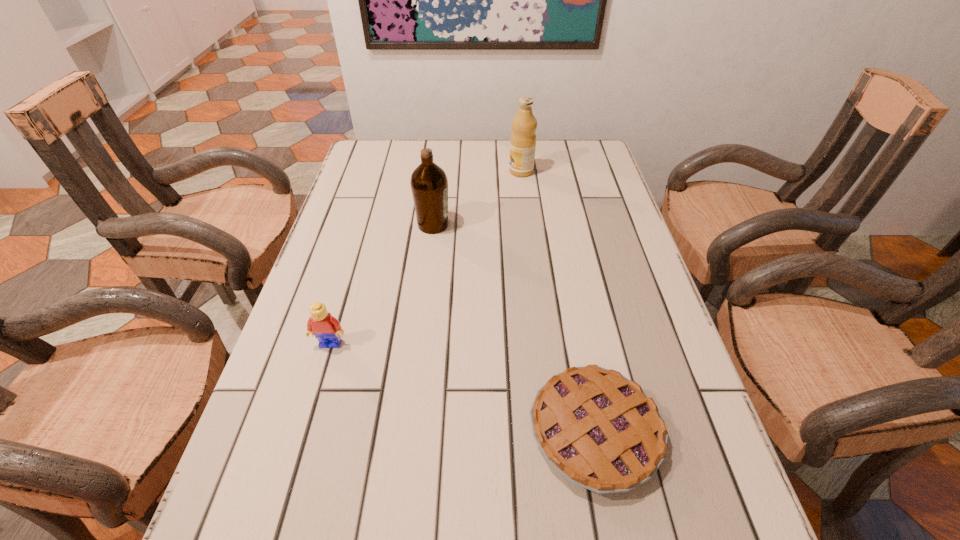
The width and height of the screenshot is (960, 540). I want to click on free point located on the label of the farther olive oil, so click(x=423, y=171).

You are a GUI agent. You are given a task and a screenshot of the screen. Output one action in this format:
    pyautogui.click(x=<x>, y=<y>)
    Task: Click on the vacant region located 0.180m on the label of the third nearest object
    
    Given the screenshot: What is the action you would take?
    pyautogui.click(x=516, y=225)

I want to click on vacant space located on the front-facing side of the second nearest object, so click(x=304, y=433).

Find the location of a particular element. The image size is (960, 540). blank space located 0.060m on the left of the nearest object is located at coordinates (495, 431).

Locate an element on the screen. The width and height of the screenshot is (960, 540). object present at the far edge is located at coordinates (523, 138).

The image size is (960, 540). In order to click on object that is positioned at the left edge in this screenshot , I will do `click(326, 328)`.

In order to click on object that is at the right edge in this screenshot , I will do `click(601, 431)`.

I want to click on vacant position at the far edge of the desktop, so click(x=500, y=177).

This screenshot has width=960, height=540. Identify the location of vacant space at the left edge of the desktop. (364, 193).

The height and width of the screenshot is (540, 960). In the image, there is a desktop. What are the coordinates of `free space at the right edge` in the screenshot? It's located at (657, 518).